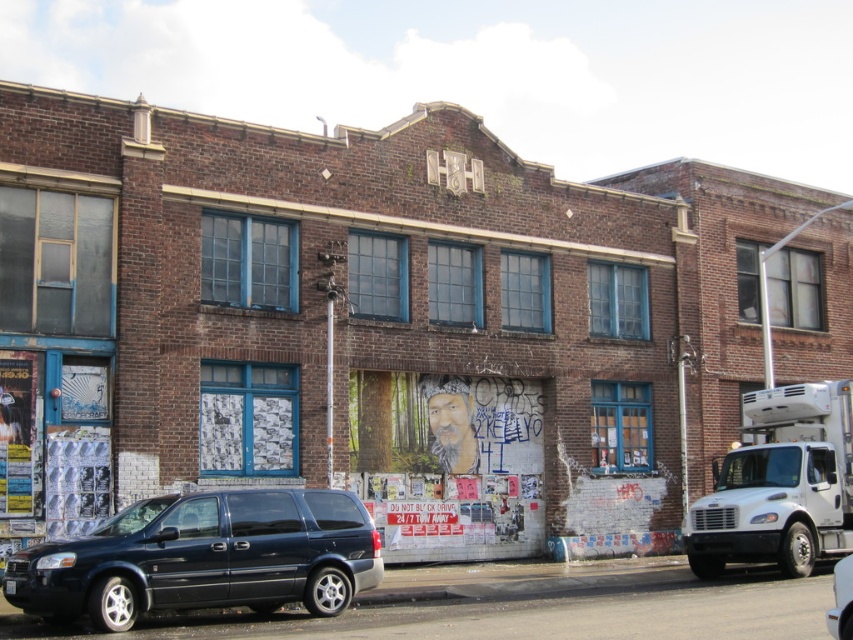
Question: Which object is the farthest from the matte black minivan at lower left?

Choices:
 (A) matte black van at center
 (B) white metallic truck at right

Answer: (B)

Question: Does matte black minivan at lower left appear on the left side of matte black van at center?

Choices:
 (A) no
 (B) yes

Answer: (B)

Question: Can you confirm if white metallic truck at right is positioned below matte black van at center?

Choices:
 (A) yes
 (B) no

Answer: (B)

Question: Is matte black minivan at lower left wider than white metallic truck at right?

Choices:
 (A) yes
 (B) no

Answer: (A)

Question: Which of the following is the farthest from the observer?

Choices:
 (A) coord(302,490)
 (B) coord(804,385)
 (C) coord(830,627)

Answer: (B)

Question: Which of these objects is positioned farthest from the matte black minivan at lower left?

Choices:
 (A) matte black van at center
 (B) white metallic truck at right

Answer: (B)